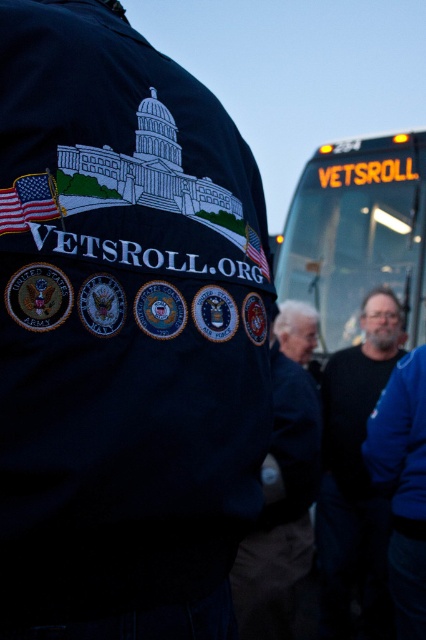
Question: Which point is farther to the camera?

Choices:
 (A) translucent glass bus at center
 (B) dark blue jacket at center
 (C) matte black jacket at center

Answer: (A)

Question: Which of these objects is positioned closest to the dark blue jacket at center?

Choices:
 (A) blue denim jacket at lower right
 (B) matte black jacket at center

Answer: (A)

Question: Is translucent glass bus at center further to the viewer compared to dark blue jacket at center?

Choices:
 (A) yes
 (B) no

Answer: (A)

Question: Which is farther from the dark blue jacket at center?

Choices:
 (A) matte black jacket at center
 (B) blue denim jacket at lower right

Answer: (A)

Question: Can you confirm if translucent glass bus at center is positioned above dark blue jacket at center?

Choices:
 (A) yes
 (B) no

Answer: (A)

Question: Is matte black jacket at center to the left of dark blue jacket at center from the viewer's perspective?

Choices:
 (A) yes
 (B) no

Answer: (A)